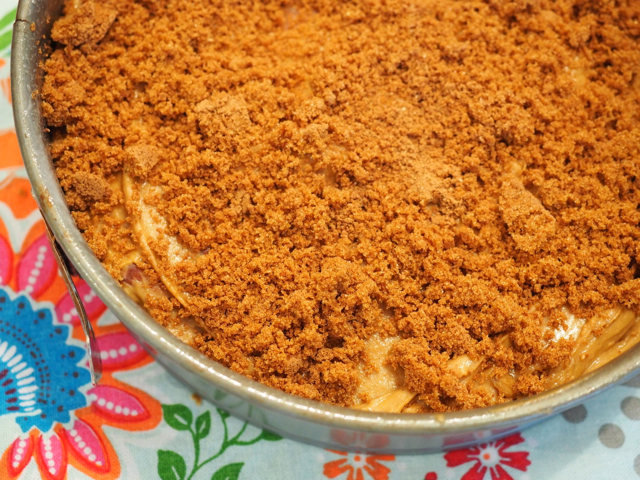
Locate an element on the screen. piece of the handle is located at coordinates (75, 293).